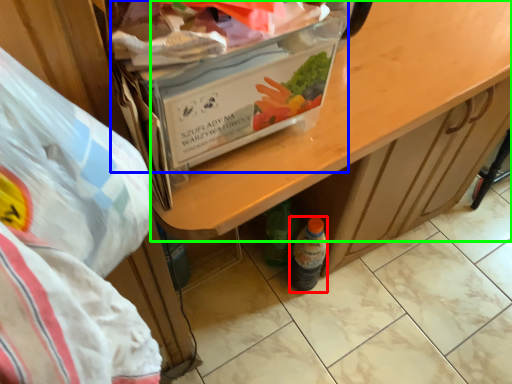
Question: Considering the real-world distances, which object is closest to bottle (highlighted by a red box)? box (highlighted by a blue box) or desk (highlighted by a green box).

Choices:
 (A) box
 (B) desk

Answer: (B)